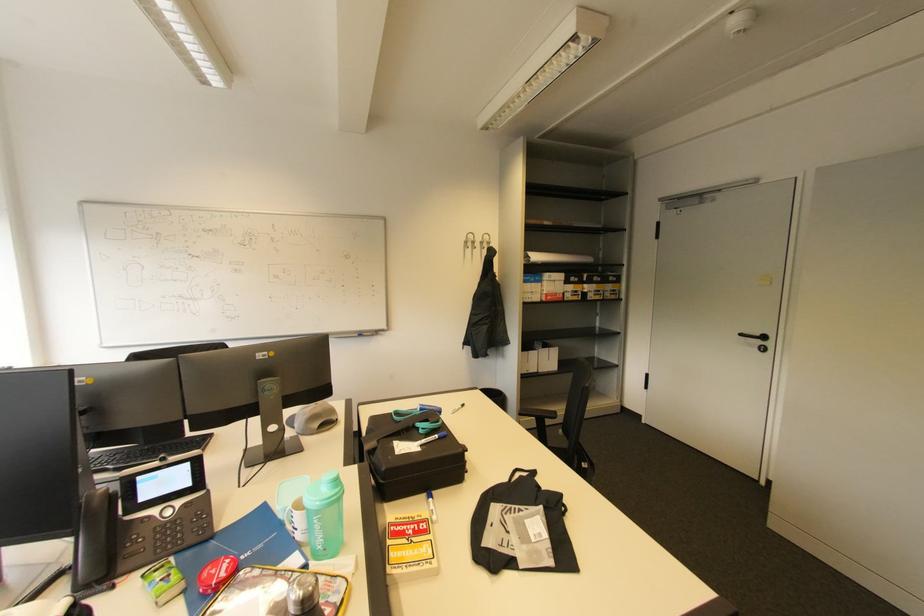
Locate an element on the screen. The width and height of the screenshot is (924, 616). black drawstring bag is located at coordinates pyautogui.click(x=520, y=527).